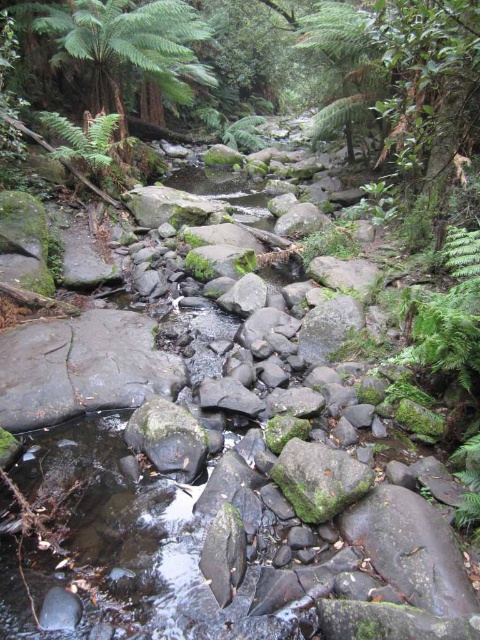
Question: Which point appears farthest from the camera in this image?

Choices:
 (A) (106, 154)
 (B) (304, 468)

Answer: (A)

Question: Can you confirm if green mossy rock at center is positioned below green fuzzy fern at upper left?

Choices:
 (A) no
 (B) yes

Answer: (B)

Question: Does green mossy rock at center have a smaller size compared to green fuzzy fern at upper left?

Choices:
 (A) no
 (B) yes

Answer: (B)

Question: Can you confirm if green mossy rock at center is smaller than green fuzzy fern at upper left?

Choices:
 (A) no
 (B) yes

Answer: (B)